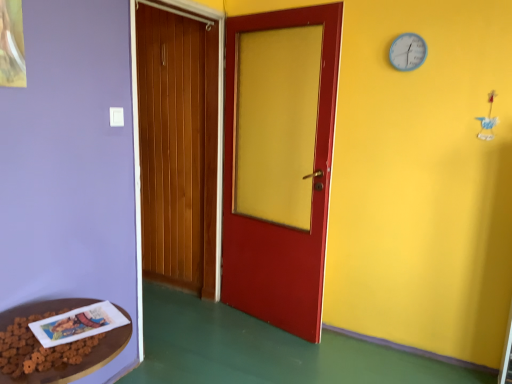
Question: Is brown wooden table at lower left wider or thinner than blue plastic clock at upper right?

Choices:
 (A) wide
 (B) thin

Answer: (A)

Question: In terms of height, does brown wooden table at lower left look taller or shorter compared to blue plastic clock at upper right?

Choices:
 (A) short
 (B) tall

Answer: (A)

Question: Considering the real-world distances, which object is farthest from the brown wooden table at lower left?

Choices:
 (A) blue plastic clock at upper right
 (B) white paper book at lower left

Answer: (A)

Question: Which of these objects is positioned farthest from the white paper book at lower left?

Choices:
 (A) brown wooden table at lower left
 (B) blue plastic clock at upper right

Answer: (B)